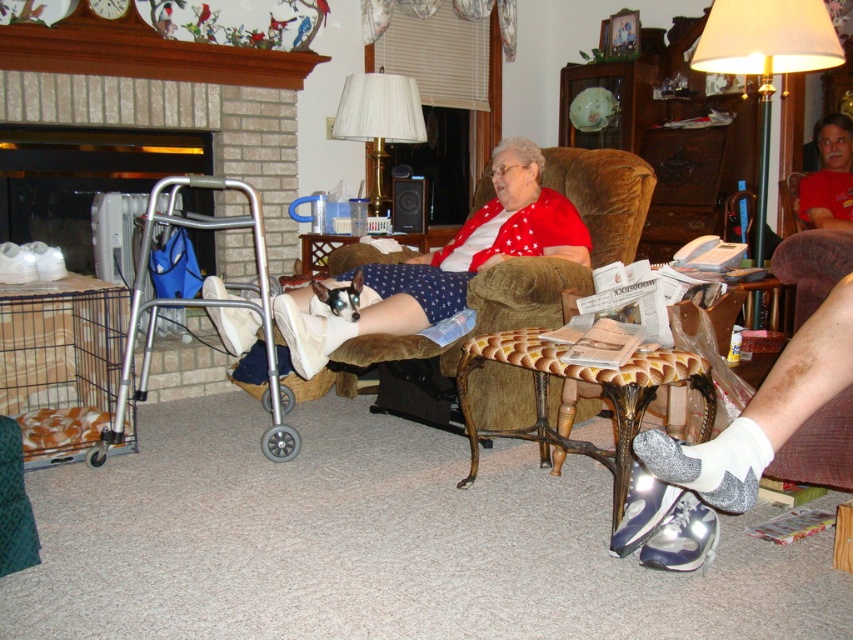
Question: Considering the real-world distances, which object is closest to the white textured socks at lower right?

Choices:
 (A) matte red blouse at center
 (B) gold metallic floor lamp at upper right

Answer: (A)

Question: Can you confirm if matte red blouse at center is wider than printed paper magazine at center?

Choices:
 (A) no
 (B) yes

Answer: (B)

Question: Which is nearer to the velvet brown armchair at center?

Choices:
 (A) gold metallic floor lamp at upper right
 (B) white textured socks at lower right
 (C) white fabric lampshade at upper center
 (D) printed paper magazine at center

Answer: (D)

Question: Does white textured socks at lower right appear over printed paper magazine at center?

Choices:
 (A) no
 (B) yes

Answer: (A)

Question: Which of these objects is positioned closest to the white fabric lampshade at upper center?

Choices:
 (A) matte red blouse at center
 (B) white textured socks at lower right

Answer: (A)

Question: Can you confirm if matte red blouse at center is positioned to the right of white textured socks at lower right?

Choices:
 (A) no
 (B) yes

Answer: (A)